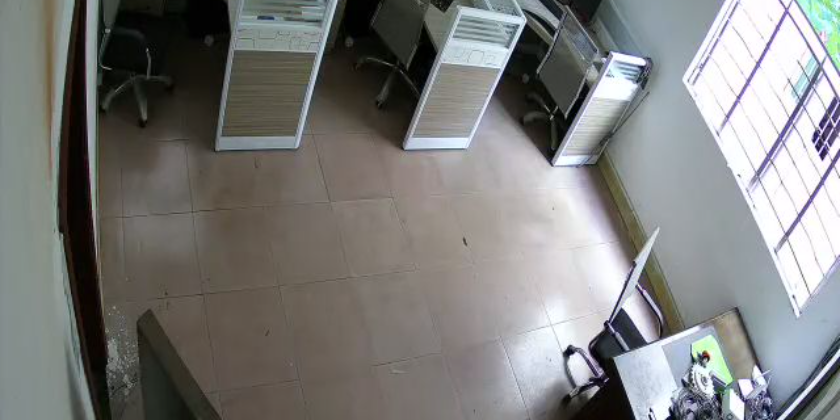
Image resolution: width=840 pixels, height=420 pixels. In order to click on while wall in this screenshot , I will do `click(672, 169)`, `click(13, 178)`.